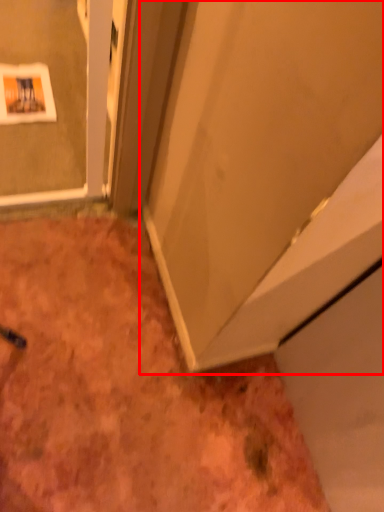
Question: Where is door (annotated by the red box) located in relation to dirt in the image?

Choices:
 (A) left
 (B) right

Answer: (B)